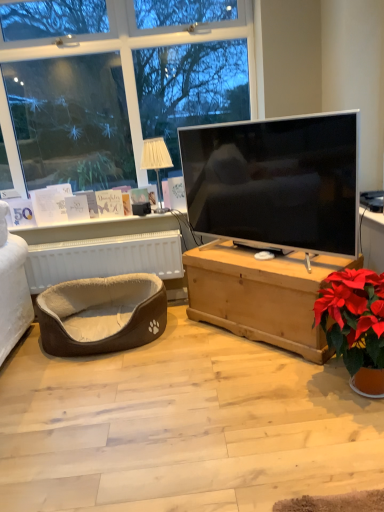
In order to click on vacant space in front of white fabric pet bed at lower left in this screenshot , I will do `click(107, 377)`.